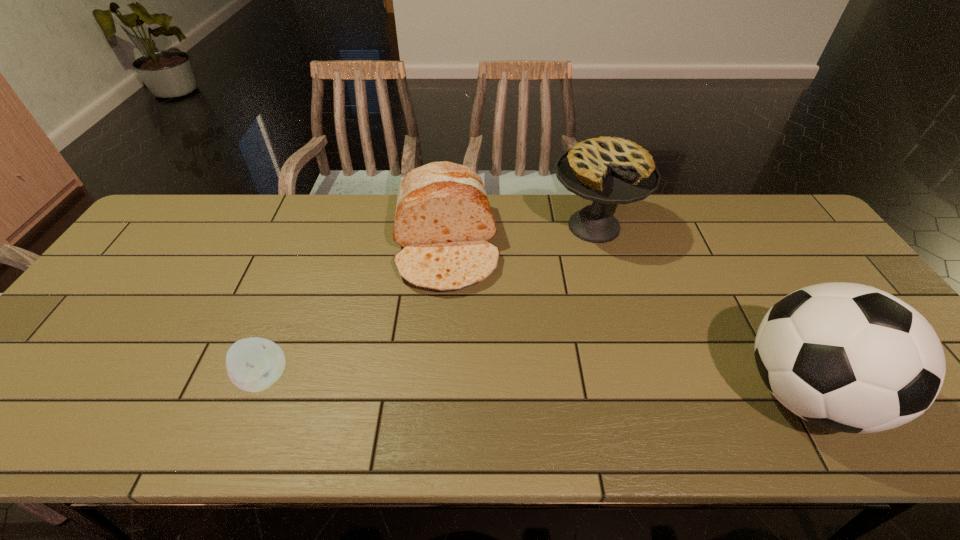
Locate an element on the screen. The image size is (960, 540). vacant area situated 0.150m at the sliced end of the bread is located at coordinates (453, 342).

The height and width of the screenshot is (540, 960). I want to click on vacant space situated 0.360m on the cut side of the second object from right to left, so click(587, 359).

The height and width of the screenshot is (540, 960). What are the coordinates of `free space located 0.340m on the cut side of the second object from right to left` in the screenshot? It's located at (587, 352).

You are a GUI agent. You are given a task and a screenshot of the screen. Output one action in this format:
    pyautogui.click(x=<x>, y=<y>)
    Task: Click on the vacant position located 0.340m on the cut side of the second object from right to left
    This screenshot has width=960, height=540.
    Given the screenshot: What is the action you would take?
    pyautogui.click(x=587, y=352)

Image resolution: width=960 pixels, height=540 pixels. Find the location of `bread that is at the far edge`. bread that is at the far edge is located at coordinates (x=443, y=220).

At what (x,y) coordinates should I click in order to perform the action: click on pie situated at the far edge. Please return your answer as a coordinate pair (x, y). The height and width of the screenshot is (540, 960). Looking at the image, I should click on (607, 170).

Where is `apple present at the near edge`? Image resolution: width=960 pixels, height=540 pixels. apple present at the near edge is located at coordinates (253, 364).

The height and width of the screenshot is (540, 960). In order to click on soccer ball present at the near edge in this screenshot , I will do `click(848, 357)`.

Where is `object present at the right edge`? This screenshot has width=960, height=540. object present at the right edge is located at coordinates (848, 357).

Where is `object that is at the near right corner`? The image size is (960, 540). object that is at the near right corner is located at coordinates (848, 357).